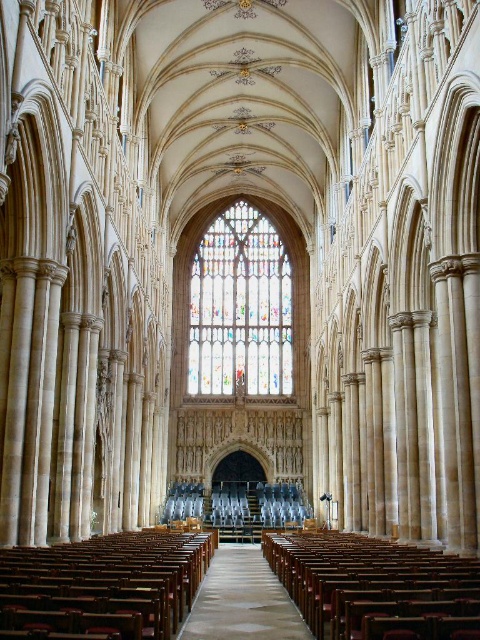
You are standing at the entrance of the cathedral and want to take a photo of the multicolored stained glass at center. Considering the cathedral is symmetrical, where should you position yourself to ensure the stained glass is centered in your photo?

Since the multicolored stained glass at center is located at point (240, 307), which is nearly the center of the image, positioning yourself directly in the middle of the entrance area would ensure the stained glass is centered in your photo.

You are standing in the cathedral and want to reach the point marked at coordinates point (x=214, y=353). The cathedral has a maximum allowed walking distance of 400 feet. Can you safely reach that point without exceeding the limit?

The distance of point (x=214, y=353) from viewer is 446.16 feet, which exceeds the maximum allowed walking distance of 400 feet. Therefore, you cannot safely reach that point without exceeding the limit.